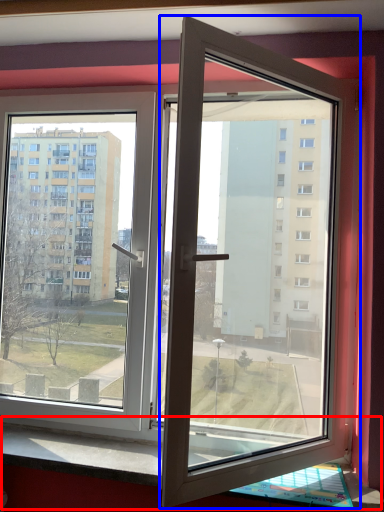
Question: Which of the following is the closest to the observer, window sill (highlighted by a red box) or door (highlighted by a blue box)?

Choices:
 (A) window sill
 (B) door

Answer: (B)